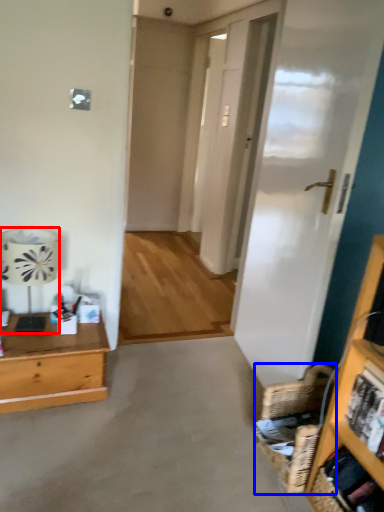
Question: Among these objects, which one is nearest to the camera, lamp (highlighted by a red box) or basket (highlighted by a blue box)?

Choices:
 (A) lamp
 (B) basket

Answer: (B)